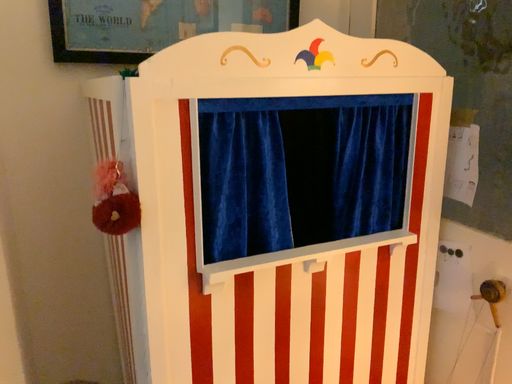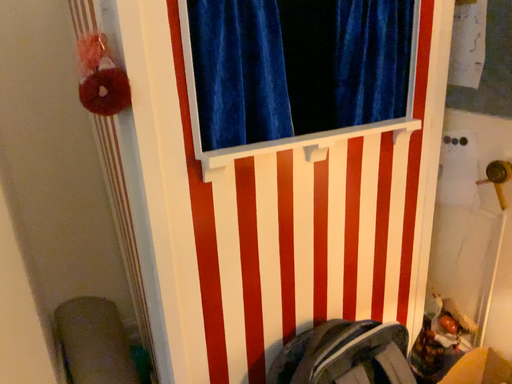
Question: How did the camera likely rotate when shooting the video?

Choices:
 (A) rotated upward
 (B) rotated downward

Answer: (B)